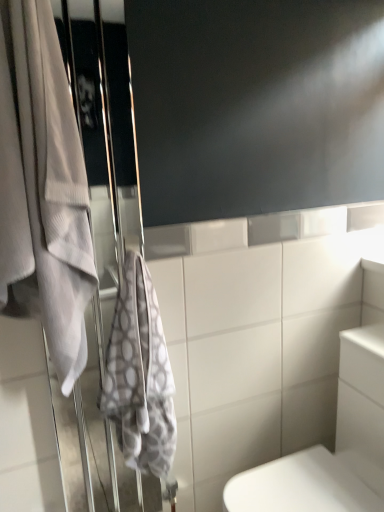
Question: Can you confirm if white fabric screen door at left is shorter than white textured towel at left, arranged as the 2th towel when viewed from the right?

Choices:
 (A) yes
 (B) no

Answer: (B)

Question: Does white fabric screen door at left have a smaller size compared to white textured towel at left, the 1th towel when ordered from left to right?

Choices:
 (A) yes
 (B) no

Answer: (B)

Question: From the image's perspective, is white fabric screen door at left below white textured towel at left, the 1th towel when ordered from left to right?

Choices:
 (A) yes
 (B) no

Answer: (A)

Question: Is white fabric screen door at left oriented towards white textured towel at left, the 1th towel when ordered from left to right?

Choices:
 (A) yes
 (B) no

Answer: (A)

Question: Is white fabric screen door at left not near white textured towel at left, arranged as the 2th towel when viewed from the right?

Choices:
 (A) yes
 (B) no

Answer: (B)

Question: From a real-world perspective, is white fabric screen door at left on top of white textured towel at left, the 1th towel when ordered from left to right?

Choices:
 (A) yes
 (B) no

Answer: (B)

Question: Is the surface of white fabric screen door at left in direct contact with white glossy toilet at lower right?

Choices:
 (A) yes
 (B) no

Answer: (B)

Question: Would you say white fabric screen door at left is outside white glossy toilet at lower right?

Choices:
 (A) yes
 (B) no

Answer: (A)

Question: Considering the relative sizes of white fabric screen door at left and white glossy toilet at lower right in the image provided, is white fabric screen door at left bigger than white glossy toilet at lower right?

Choices:
 (A) no
 (B) yes

Answer: (A)

Question: Can you confirm if white fabric screen door at left is smaller than white glossy toilet at lower right?

Choices:
 (A) no
 (B) yes

Answer: (B)

Question: Is white fabric screen door at left far from white glossy toilet at lower right?

Choices:
 (A) no
 (B) yes

Answer: (A)

Question: Is white glossy toilet at lower right a part of white fabric screen door at left?

Choices:
 (A) no
 (B) yes

Answer: (A)

Question: From the image's perspective, is white glossy toilet at lower right beneath white fabric screen door at left?

Choices:
 (A) no
 (B) yes

Answer: (B)